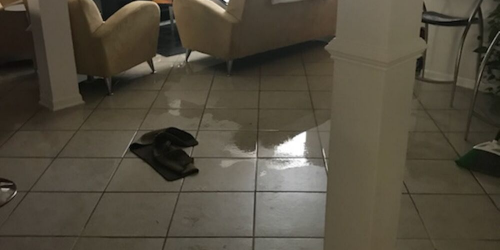
This screenshot has height=250, width=500. I want to click on pillar, so click(386, 134).